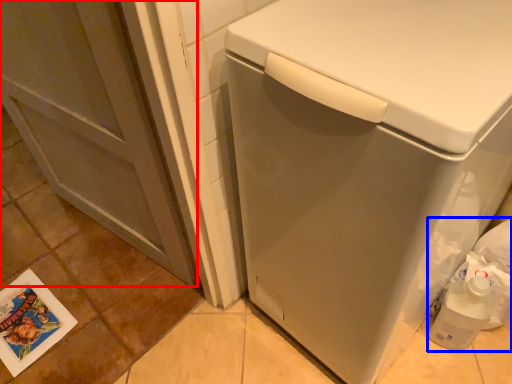
Question: Which object is further to the camera taking this photo, screen door (highlighted by a red box) or garbage (highlighted by a blue box)?

Choices:
 (A) screen door
 (B) garbage

Answer: (B)